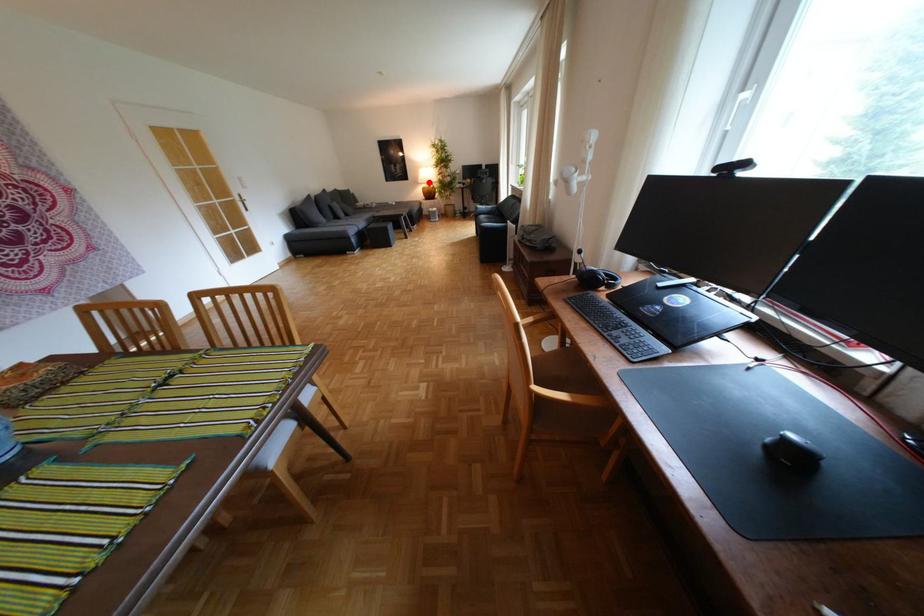
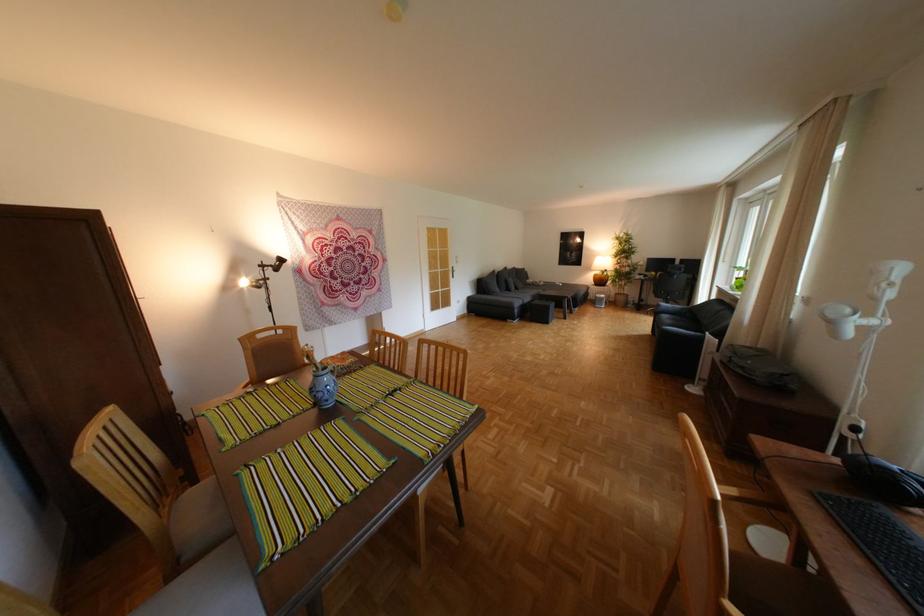
Question: I am providing you with two images of the same scene from different viewpoints. In image1, a red point is highlighted. Considering the same 3D point in image2, which of the following is correct?

Choices:
 (A) It is closer
 (B) It is farther

Answer: (B)